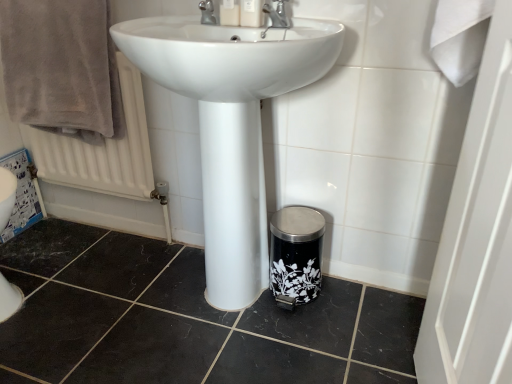
Question: Is matte plastic soap dispenser at upper center, placed as the second toiletry when sorted from right to left, inside or outside of white glossy sink at center?

Choices:
 (A) outside
 (B) inside

Answer: (A)

Question: Looking at the image, does matte plastic soap dispenser at upper center, placed as the second toiletry when sorted from right to left, seem bigger or smaller compared to white glossy sink at center?

Choices:
 (A) small
 (B) big

Answer: (A)

Question: Estimate the real-world distances between objects in this image. Which object is closer to the white plastic soap dispenser at upper center, which is the second toiletry in left-to-right order?

Choices:
 (A) silver metallic tap at upper center, which ranks as the second tap in right-to-left order
 (B) silver metallic tap at upper center, marked as the second tap in a left-to-right arrangement
 (C) black marble tile at lower center
 (D) white glossy sink at center
 (E) matte plastic soap dispenser at upper center, placed as the second toiletry when sorted from right to left

Answer: (E)

Question: Estimate the real-world distances between objects in this image. Which object is closer to the white textured radiator at upper left?

Choices:
 (A) matte plastic soap dispenser at upper center, placed as the second toiletry when sorted from right to left
 (B) black marble tile at lower center
 (C) brown soft towel at upper left
 (D) silver metallic tap at upper center, which ranks as the second tap in right-to-left order
 (E) white glossy sink at center

Answer: (C)